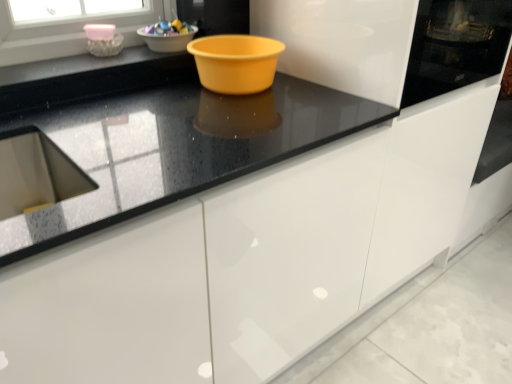
Locate an element on the screen. This screenshot has height=384, width=512. matte plastic bowl at upper center, which appears as the 1th basin when viewed from the right is located at coordinates (167, 41).

Where is `black glossy countertop at upper center`? The image size is (512, 384). black glossy countertop at upper center is located at coordinates (79, 65).

How much space does pink glass bowl at upper left, which is the first basin in left-to-right order, occupy vertically?

It is 1.91 inches.

This screenshot has height=384, width=512. What are the coordinates of `matte plastic bowl at upper center, acting as the second basin starting from the left` in the screenshot? It's located at tap(167, 41).

Between shiny plastic bowl at upper center and black glossy countertop at center, which one has smaller size?

shiny plastic bowl at upper center is smaller.

Which is in front, point (154, 26) or point (22, 235)?

The point (22, 235) is closer to the camera.

Which is in front, shiny plastic bowl at upper center or black glossy countertop at center?

black glossy countertop at center is in front.

How distant is black glossy countertop at upper center from shiny plastic bowl at upper center?

A distance of 8.13 inches exists between black glossy countertop at upper center and shiny plastic bowl at upper center.

In the scene shown: Is black glossy countertop at upper center with shiny plastic bowl at upper center?

No, black glossy countertop at upper center is not with shiny plastic bowl at upper center.

Looking at the image, does black glossy countertop at upper center seem bigger or smaller compared to shiny plastic bowl at upper center?

Clearly, black glossy countertop at upper center is larger in size than shiny plastic bowl at upper center.

Are black glossy countertop at upper center and black glossy countertop at center far apart?

No, there isn't a large distance between black glossy countertop at upper center and black glossy countertop at center.

Between black glossy countertop at upper center and black glossy countertop at center, which one appears on the right side from the viewer's perspective?

black glossy countertop at center is more to the right.

Is point (26, 71) closer to camera compared to point (36, 121)?

No, (26, 71) is behind (36, 121).

Is black glossy countertop at upper center facing away from black glossy countertop at center?

black glossy countertop at upper center is not turned away from black glossy countertop at center.

Based on their positions, is black glossy countertop at center located to the left or right of matte plastic bowl at upper center, acting as the second basin starting from the left?

In the image, black glossy countertop at center appears on the right side of matte plastic bowl at upper center, acting as the second basin starting from the left.

In the scene shown: From a real-world perspective, does black glossy countertop at center sit lower than matte plastic bowl at upper center, which appears as the 1th basin when viewed from the right?

Yes.

At what (x,y) coordinates should I click in order to perform the action: click on countertop that appears below the matte plastic bowl at upper center, which appears as the 1th basin when viewed from the right (from the image's perspective). Please return your answer as a coordinate pair (x, y). The image size is (512, 384). Looking at the image, I should click on (175, 148).

From the image's perspective, is black glossy countertop at center on matte plastic bowl at upper center, acting as the second basin starting from the left?

No, from the image's perspective, black glossy countertop at center is not above matte plastic bowl at upper center, acting as the second basin starting from the left.

Which is behind, point (165, 51) or point (118, 36)?

Positioned behind is point (165, 51).

From the image's perspective, is matte plastic bowl at upper center, acting as the second basin starting from the left, above or below pink glass bowl at upper left, which is the first basin in left-to-right order?

matte plastic bowl at upper center, acting as the second basin starting from the left, is situated higher than pink glass bowl at upper left, which is the first basin in left-to-right order, in the image.

Is matte plastic bowl at upper center, acting as the second basin starting from the left, not near pink glass bowl at upper left, the 2th basin when ordered from right to left?

Actually, matte plastic bowl at upper center, acting as the second basin starting from the left, and pink glass bowl at upper left, the 2th basin when ordered from right to left, are a little close together.

Consider the image. Does matte plastic bowl at upper center, acting as the second basin starting from the left, lie behind pink glass bowl at upper left, which is the first basin in left-to-right order?

Yes, matte plastic bowl at upper center, acting as the second basin starting from the left, is further from the camera.

From the image's perspective, is shiny plastic bowl at upper center on top of matte plastic bowl at upper center, acting as the second basin starting from the left?

Yes, from the image's perspective, shiny plastic bowl at upper center is on top of matte plastic bowl at upper center, acting as the second basin starting from the left.

Is shiny plastic bowl at upper center facing towards matte plastic bowl at upper center, which appears as the 1th basin when viewed from the right?

No, shiny plastic bowl at upper center is not turned towards matte plastic bowl at upper center, which appears as the 1th basin when viewed from the right.

Where is `the 1st basin below the shiny plastic bowl at upper center (from the image's perspective)`? Image resolution: width=512 pixels, height=384 pixels. the 1st basin below the shiny plastic bowl at upper center (from the image's perspective) is located at coordinates (167, 41).

Consider the image. From the image's perspective, which one is positioned lower, pink glass bowl at upper left, which is the first basin in left-to-right order, or black glossy countertop at center?

black glossy countertop at center, from the image's perspective.

Is pink glass bowl at upper left, which is the first basin in left-to-right order, bigger than black glossy countertop at center?

No, pink glass bowl at upper left, which is the first basin in left-to-right order, is not bigger than black glossy countertop at center.

Between pink glass bowl at upper left, which is the first basin in left-to-right order, and black glossy countertop at center, which one has less height?

With less height is pink glass bowl at upper left, which is the first basin in left-to-right order.

Relative to black glossy countertop at center, is pink glass bowl at upper left, which is the first basin in left-to-right order, in front or behind?

Clearly, pink glass bowl at upper left, which is the first basin in left-to-right order, is behind black glossy countertop at center.

Find the location of `food behind the black glossy countertop at center`. food behind the black glossy countertop at center is located at coordinates (168, 28).

You are a GUI agent. You are given a task and a screenshot of the screen. Output one action in this format:
    pyautogui.click(x=<x>, y=<y>)
    Task: Click on the food above the black glossy countertop at upper center (from a real-world perspective)
    Image resolution: width=512 pixels, height=384 pixels.
    Given the screenshot: What is the action you would take?
    pyautogui.click(x=168, y=28)

Based on their spatial positions, is shiny plastic bowl at upper center or pink glass bowl at upper left, the 2th basin when ordered from right to left, closer to black glossy countertop at upper center?

The object closer to black glossy countertop at upper center is pink glass bowl at upper left, the 2th basin when ordered from right to left.

Estimate the real-world distances between objects in this image. Which object is further from black glossy countertop at center, pink glass bowl at upper left, the 2th basin when ordered from right to left, or shiny plastic bowl at upper center?

pink glass bowl at upper left, the 2th basin when ordered from right to left, is further to black glossy countertop at center.

Estimate the real-world distances between objects in this image. Which object is closer to black glossy countertop at center, shiny plastic bowl at upper center or black glossy countertop at upper center?

The object closer to black glossy countertop at center is black glossy countertop at upper center.

Considering their positions, is black glossy countertop at center positioned closer to pink glass bowl at upper left, the 2th basin when ordered from right to left, than matte plastic bowl at upper center, which appears as the 1th basin when viewed from the right?

The object closer to pink glass bowl at upper left, the 2th basin when ordered from right to left, is matte plastic bowl at upper center, which appears as the 1th basin when viewed from the right.

Considering their positions, is shiny plastic bowl at upper center positioned further to matte plastic bowl at upper center, which appears as the 1th basin when viewed from the right, than black glossy countertop at center?

black glossy countertop at center.

Looking at the image, which one is located further to pink glass bowl at upper left, the 2th basin when ordered from right to left, matte plastic bowl at upper center, which appears as the 1th basin when viewed from the right, or black glossy countertop at upper center?

matte plastic bowl at upper center, which appears as the 1th basin when viewed from the right, is positioned further to the anchor pink glass bowl at upper left, the 2th basin when ordered from right to left.

Considering their positions, is black glossy countertop at upper center positioned closer to matte plastic bowl at upper center, which appears as the 1th basin when viewed from the right, than pink glass bowl at upper left, which is the first basin in left-to-right order?

Among the two, pink glass bowl at upper left, which is the first basin in left-to-right order, is located nearer to matte plastic bowl at upper center, which appears as the 1th basin when viewed from the right.

Based on their spatial positions, is pink glass bowl at upper left, which is the first basin in left-to-right order, or matte plastic bowl at upper center, acting as the second basin starting from the left, further from black glossy countertop at upper center?

matte plastic bowl at upper center, acting as the second basin starting from the left, is positioned further to the anchor black glossy countertop at upper center.

Where is `basin between matte plastic bowl at upper center, acting as the second basin starting from the left, and black glossy countertop at center in the up-down direction`? The height and width of the screenshot is (384, 512). basin between matte plastic bowl at upper center, acting as the second basin starting from the left, and black glossy countertop at center in the up-down direction is located at coordinates (105, 45).

Where is `counter top between shiny plastic bowl at upper center and black glossy countertop at center in the vertical direction`? The image size is (512, 384). counter top between shiny plastic bowl at upper center and black glossy countertop at center in the vertical direction is located at coordinates (79, 65).

Image resolution: width=512 pixels, height=384 pixels. I want to click on counter top between pink glass bowl at upper left, which is the first basin in left-to-right order, and black glossy countertop at center, in the vertical direction, so click(79, 65).

Locate an element on the screen. Image resolution: width=512 pixels, height=384 pixels. food between black glossy countertop at upper center and matte plastic bowl at upper center, acting as the second basin starting from the left, in the front-back direction is located at coordinates (168, 28).